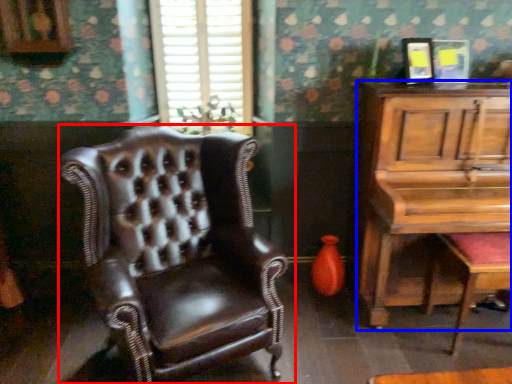
Question: Which of the following is the farthest to the observer, chair (highlighted by a red box) or table (highlighted by a blue box)?

Choices:
 (A) chair
 (B) table

Answer: (B)